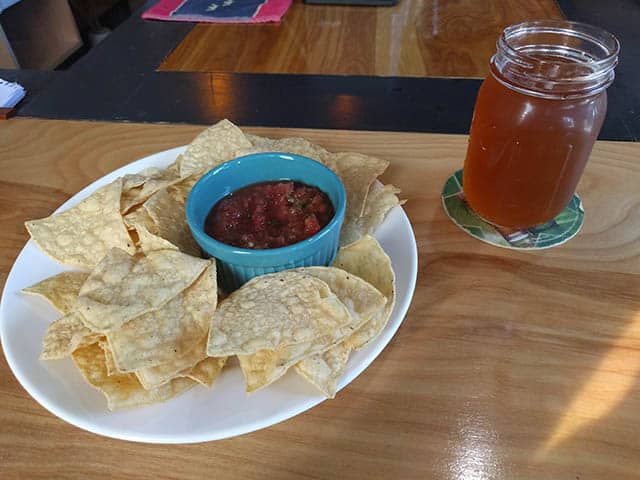
In order to click on jar in this screenshot , I will do `click(539, 139)`.